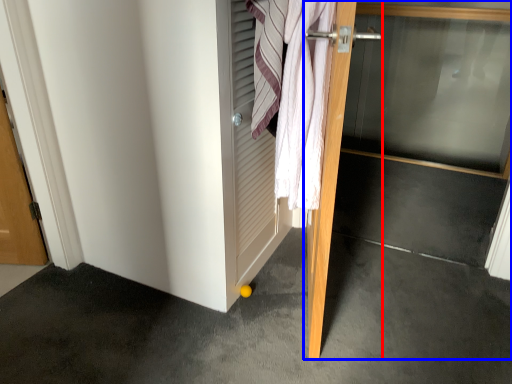
Question: Among these objects, which one is farthest to the camera, door (highlighted by a red box) or door (highlighted by a blue box)?

Choices:
 (A) door
 (B) door

Answer: (B)